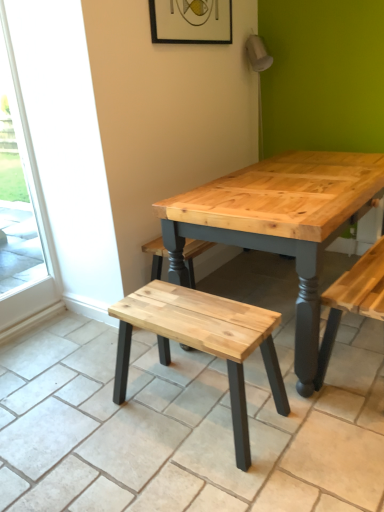
Where is `vacant area situated below natural wood stool at center (from a real-world perspective)`? This screenshot has width=384, height=512. vacant area situated below natural wood stool at center (from a real-world perspective) is located at coordinates (200, 404).